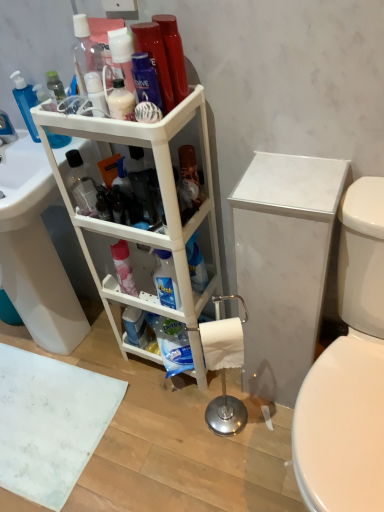
Question: Is blue matte container at center, the 1th toiletry positioned from the back, looking in the opposite direction of white plastic shelf at center?

Choices:
 (A) no
 (B) yes

Answer: (B)

Question: From a real-world perspective, is blue matte container at center, which ranks as the 2th toiletry in right-to-left order, positioned over white plastic shelf at center based on gravity?

Choices:
 (A) no
 (B) yes

Answer: (A)

Question: From the image's perspective, is blue matte container at center, the 1th toiletry positioned from the back, located above white plastic shelf at center?

Choices:
 (A) no
 (B) yes

Answer: (A)

Question: Is blue matte container at center, which is the 1th toiletry in left-to-right order, outside white plastic shelf at center?

Choices:
 (A) yes
 (B) no

Answer: (B)

Question: Is there a large distance between blue matte container at center, which ranks as the 2th toiletry in right-to-left order, and white plastic shelf at center?

Choices:
 (A) no
 (B) yes

Answer: (A)

Question: Is white plastic shelf at center surrounded by blue matte container at center, the 1th toiletry positioned from the back?

Choices:
 (A) yes
 (B) no

Answer: (B)

Question: Is white matte toilet paper at lower center a part of white glossy sink at lower left?

Choices:
 (A) yes
 (B) no

Answer: (B)

Question: Can you confirm if white glossy sink at lower left is wider than white matte toilet paper at lower center?

Choices:
 (A) no
 (B) yes

Answer: (B)

Question: Could you tell me if white glossy sink at lower left is facing white matte toilet paper at lower center?

Choices:
 (A) yes
 (B) no

Answer: (B)

Question: Is white glossy sink at lower left touching white matte toilet paper at lower center?

Choices:
 (A) no
 (B) yes

Answer: (A)

Question: Is white glossy sink at lower left bigger than white matte toilet paper at lower center?

Choices:
 (A) yes
 (B) no

Answer: (A)

Question: Is white glossy sink at lower left positioned before white matte toilet paper at lower center?

Choices:
 (A) yes
 (B) no

Answer: (A)

Question: From a real-world perspective, is white marble cabinet at right located beneath white plastic shelf at center?

Choices:
 (A) yes
 (B) no

Answer: (A)